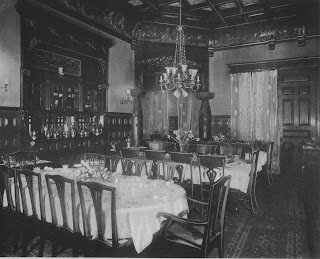
The image size is (320, 259). I want to click on wall, so click(151, 44).